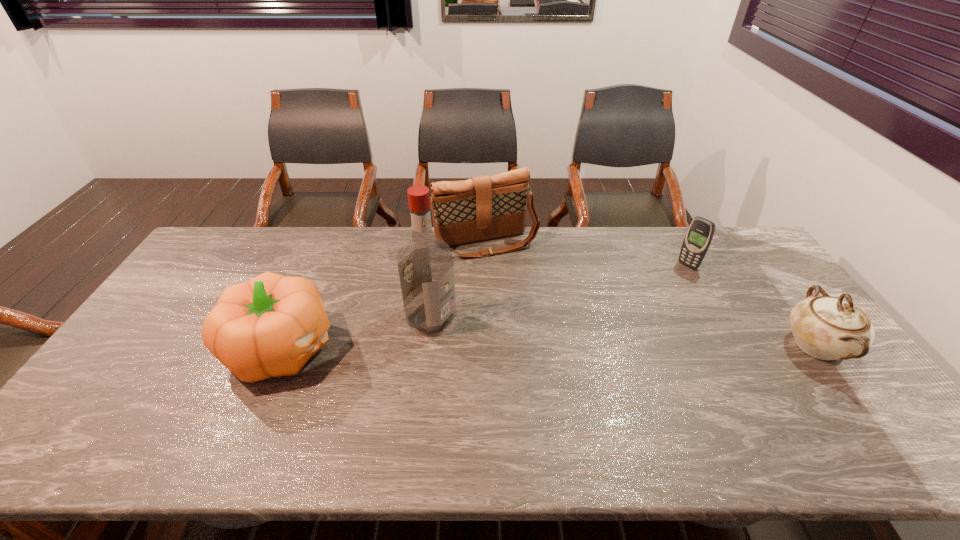
This screenshot has width=960, height=540. I want to click on vacant point located between the shoulder bag and the tallest object, so click(x=459, y=280).

This screenshot has height=540, width=960. Identify the location of vacant space that is in between the leftmost object and the second object from right to left. (485, 307).

In order to click on vacant point located between the chinaware and the shoulder bag in this screenshot , I will do `click(651, 294)`.

This screenshot has width=960, height=540. In order to click on free area in between the fourth object from left to right and the tallest object in this screenshot , I will do `click(560, 292)`.

At what (x,y) coordinates should I click in order to perform the action: click on free space between the chinaware and the fourth object from left to right. Please return your answer as a coordinate pair (x, y). This screenshot has width=960, height=540. Looking at the image, I should click on (752, 306).

The image size is (960, 540). Identify the location of object identified as the closest to the shoulder bag. (425, 263).

Identify the location of object that ranks as the closest to the pumpkin. The image size is (960, 540). (425, 263).